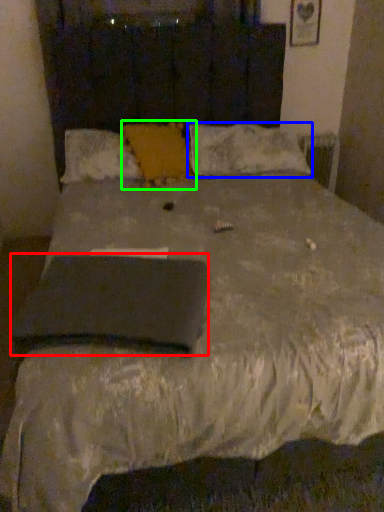
Question: Estimate the real-world distances between objects in this image. Which object is closer to pad (highlighted by a red box), pillow (highlighted by a blue box) or pillow (highlighted by a green box)?

Choices:
 (A) pillow
 (B) pillow

Answer: (B)